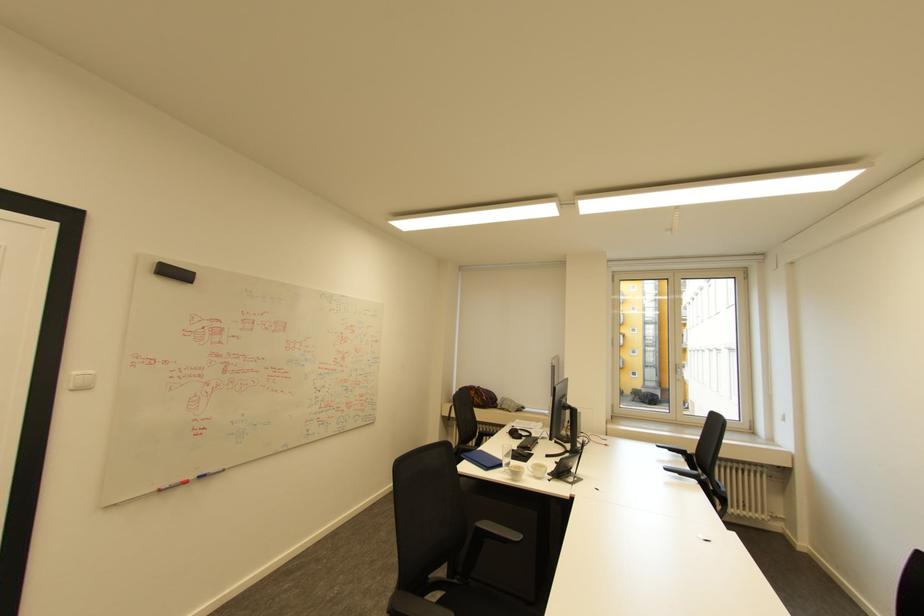
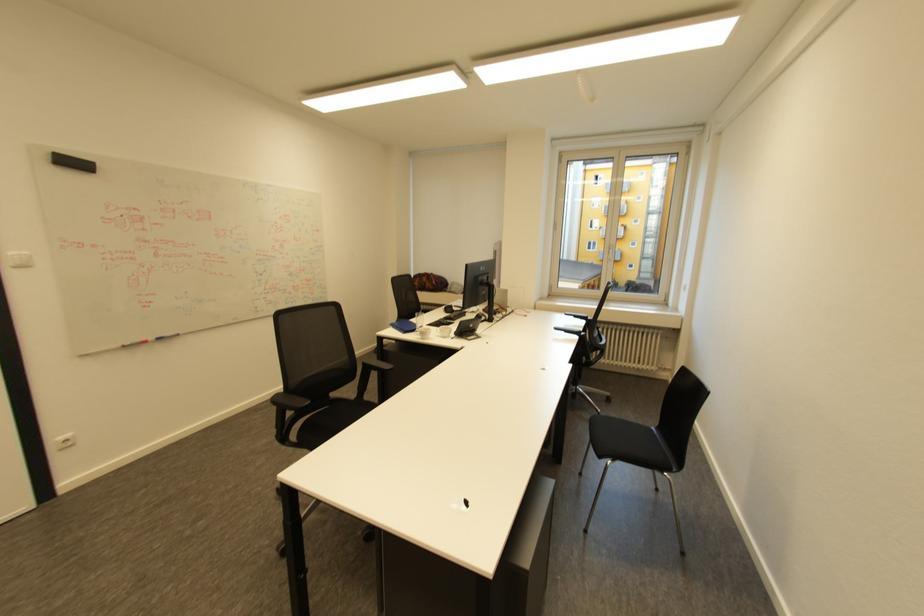
The point at [165,490] is marked in the first image. Where is the corresponding point in the second image?

(128, 346)